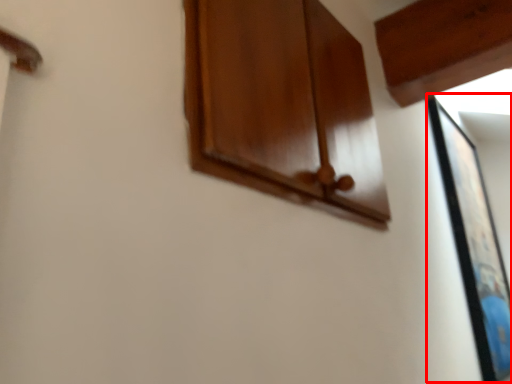
Question: Observing the image, what is the correct spatial positioning of picture frame (annotated by the red box) in reference to cabinetry?

Choices:
 (A) right
 (B) left

Answer: (A)